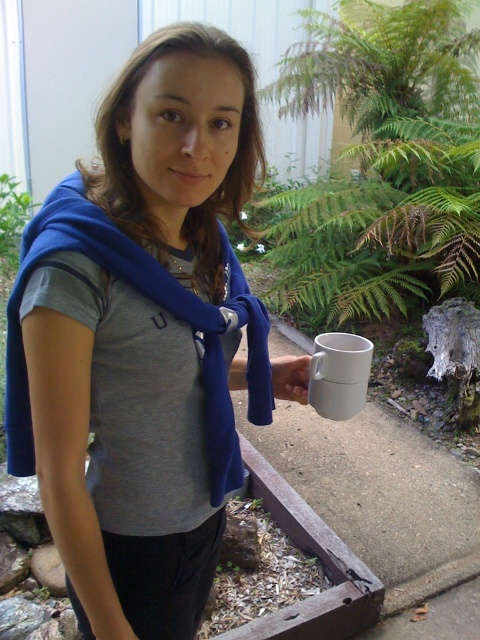
Question: Estimate the real-world distances between objects in this image. Which object is farther from the white matte mug at lower right?

Choices:
 (A) blue fleece scarf at left
 (B) white matte cup at center
 (C) blue fabric scarf at upper left

Answer: (C)

Question: Does blue fabric scarf at upper left have a larger size compared to white matte mug at lower right?

Choices:
 (A) yes
 (B) no

Answer: (A)

Question: Which object is farther from the camera taking this photo?

Choices:
 (A) white matte cup at center
 (B) blue fabric scarf at upper left
 (C) white matte mug at lower right
 (D) blue fleece scarf at left

Answer: (A)

Question: Does blue fabric scarf at upper left lie in front of white matte cup at center?

Choices:
 (A) no
 (B) yes

Answer: (B)

Question: Is blue fleece scarf at left positioned at the back of white matte mug at lower right?

Choices:
 (A) yes
 (B) no

Answer: (B)

Question: Which is nearer to the blue fabric scarf at upper left?

Choices:
 (A) white matte mug at lower right
 (B) white matte cup at center
 (C) blue fleece scarf at left

Answer: (C)